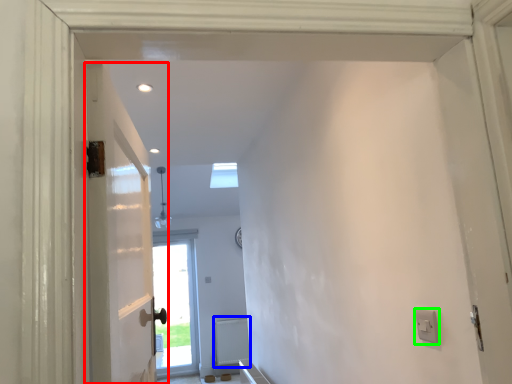
Question: Which object is the farthest from door (highlighted by a red box)? Choose among these: radiator (highlighted by a blue box) or electric outlet (highlighted by a green box).

Choices:
 (A) radiator
 (B) electric outlet

Answer: (A)